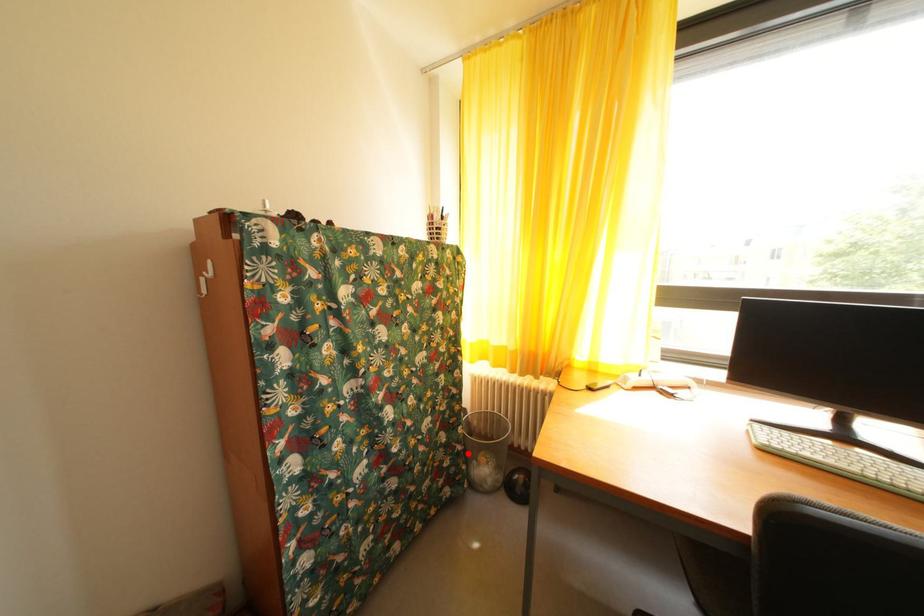
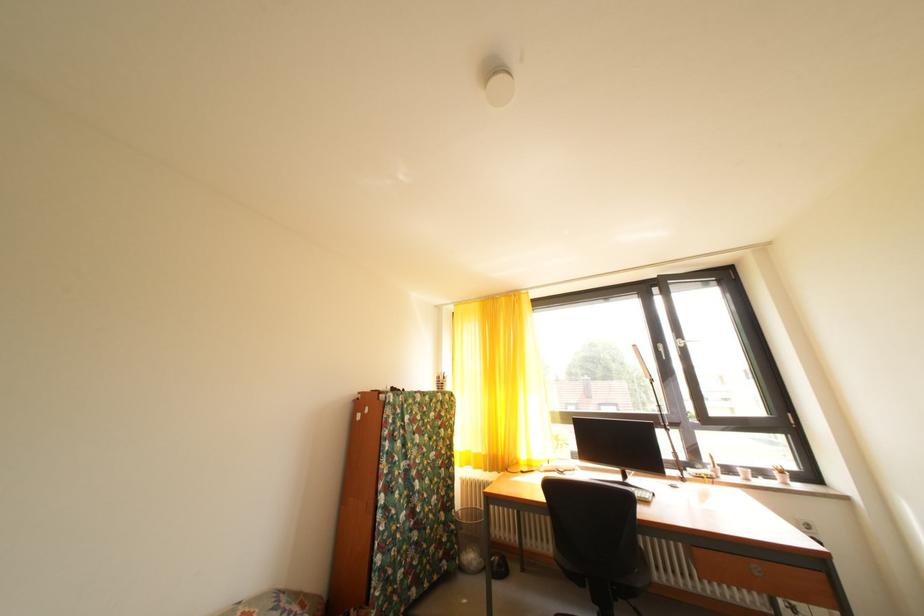
The point at the highlighted location is marked in the first image. Where is the corresponding point in the second image?

(462, 533)